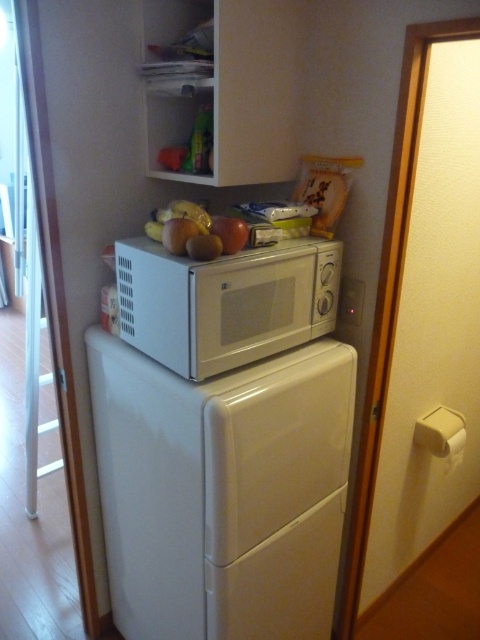
You are organizing the kitchen and need to place the yellow matte apple at upper center on the counter. The white matte microwave at center is currently occupying the space. Can the apple be placed on top of the microwave?

The white matte microwave at center is larger in size than the yellow matte apple at upper center. Since the microwave is larger, it might have a flat surface big enough to accommodate the apple. However, the microwave is already on top of the refrigerator, so placing the apple there may not be safe or practical. Consider placing the apple on the counter instead where there is space below the shelf with bananas and apples.

You are organizing items in the kitchen and need to place a matte red apple at center on the counter. Considering the white glossy refrigerator at center is in the way, can you move the apple to the right side of the refrigerator without moving the refrigerator itself?

The white glossy refrigerator at center has a greater height compared to the matte red apple at center, so yes, you can move the apple to the right side of the refrigerator since the refrigerator is taller and won